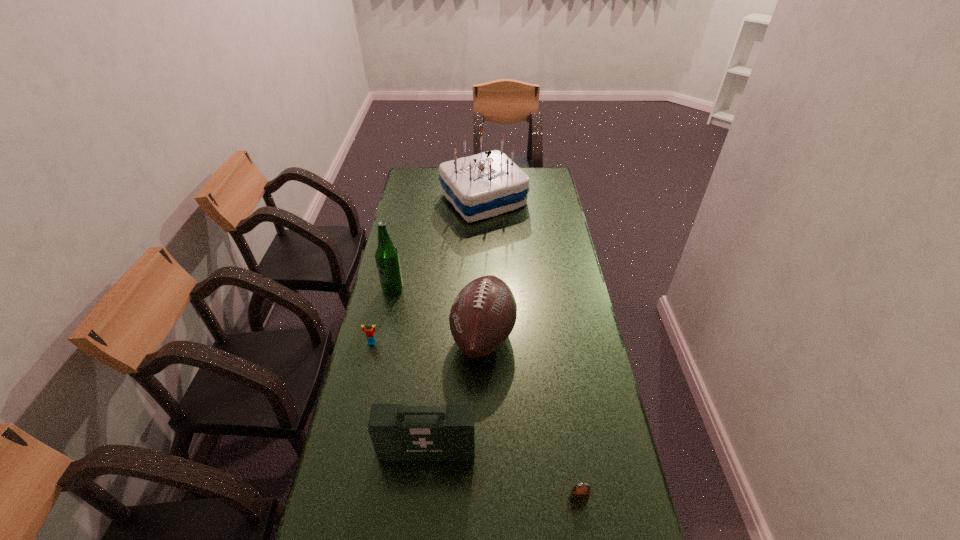
At what (x,y) coordinates should I click in order to perform the action: click on vacant area between the beer bottle and the first-aid kit. Please return your answer as a coordinate pair (x, y). This screenshot has width=960, height=540. Looking at the image, I should click on (410, 369).

Identify the location of unoccupied position between the farthest object and the football (American). The height and width of the screenshot is (540, 960). (483, 268).

Where is `the third closest object to the football (American)`? Image resolution: width=960 pixels, height=540 pixels. the third closest object to the football (American) is located at coordinates (370, 334).

In order to click on object that ranks as the third closest to the first-aid kit in this screenshot , I will do `click(370, 334)`.

Locate an element on the screen. free space that satisfies the following two spatial constraints: 1. on the label of the football (American); 2. on the right side of the beer bottle is located at coordinates (383, 336).